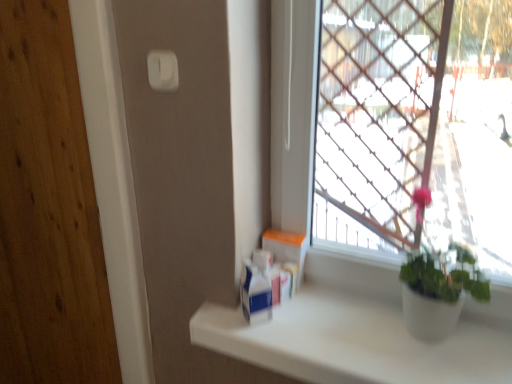
Question: From a real-world perspective, is white cardboard box at center beneath white plastic light switch at upper center?

Choices:
 (A) no
 (B) yes

Answer: (B)

Question: From the image's perspective, is white cardboard box at center located beneath white plastic light switch at upper center?

Choices:
 (A) no
 (B) yes

Answer: (B)

Question: From the image's perspective, is white cardboard box at center above white plastic light switch at upper center?

Choices:
 (A) yes
 (B) no

Answer: (B)

Question: Is white cardboard box at center shorter than white plastic light switch at upper center?

Choices:
 (A) no
 (B) yes

Answer: (A)

Question: Can you confirm if white cardboard box at center is bigger than white plastic light switch at upper center?

Choices:
 (A) yes
 (B) no

Answer: (A)

Question: Is there a large distance between white cardboard box at center and white plastic light switch at upper center?

Choices:
 (A) no
 (B) yes

Answer: (A)

Question: From the image's perspective, would you say white cardboard box at center is shown under white matte counter top at lower right?

Choices:
 (A) yes
 (B) no

Answer: (B)

Question: Can you confirm if white cardboard box at center is smaller than white matte counter top at lower right?

Choices:
 (A) no
 (B) yes

Answer: (B)

Question: Is white cardboard box at center placed right next to white matte counter top at lower right?

Choices:
 (A) yes
 (B) no

Answer: (B)

Question: Does white cardboard box at center turn towards white matte counter top at lower right?

Choices:
 (A) no
 (B) yes

Answer: (A)

Question: Is white cardboard box at center thinner than white matte counter top at lower right?

Choices:
 (A) yes
 (B) no

Answer: (A)

Question: Is white cardboard box at center not within white matte counter top at lower right?

Choices:
 (A) yes
 (B) no

Answer: (A)

Question: Is white plastic light switch at upper center to the left of white matte counter top at lower right from the viewer's perspective?

Choices:
 (A) yes
 (B) no

Answer: (A)